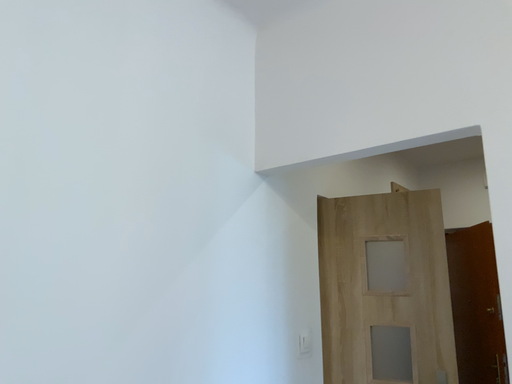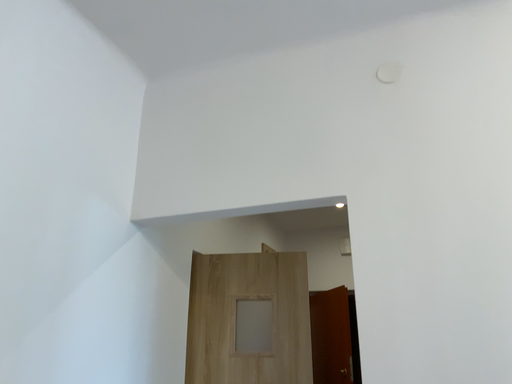
Question: How did the camera likely rotate when shooting the video?

Choices:
 (A) rotated left
 (B) rotated right

Answer: (B)